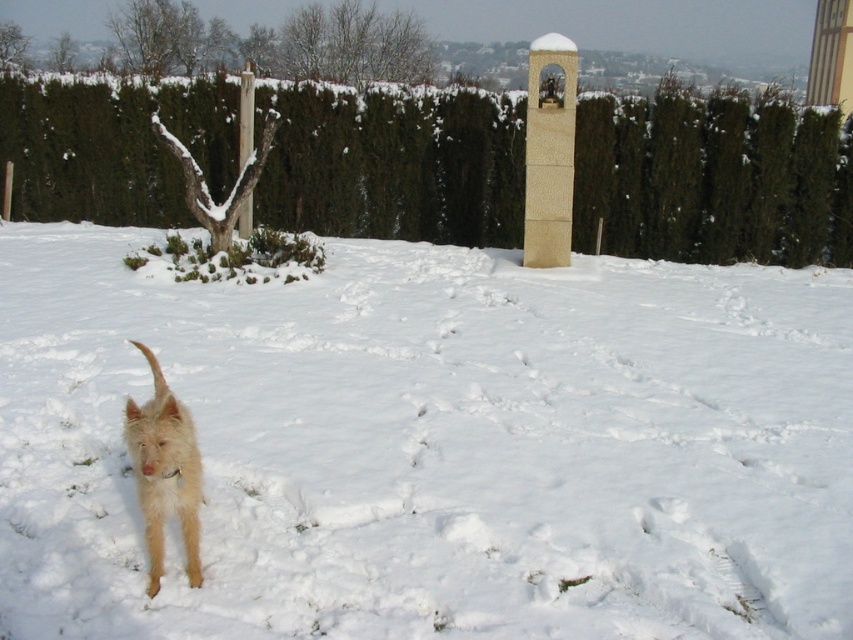
Does green hedge at upper center have a smaller size compared to fuzzy beige dog at lower left?

No, green hedge at upper center is not smaller than fuzzy beige dog at lower left.

Between green hedge at upper center and fuzzy beige dog at lower left, which one has less height?

With less height is fuzzy beige dog at lower left.

Between point (721, 198) and point (155, 468), which one is positioned in front?

Point (155, 468) is more forward.

Locate an element on the screen. This screenshot has height=640, width=853. green hedge at upper center is located at coordinates (712, 179).

Is white fluffy snow at center above green hedge at upper center?

No.

Which is above, white fluffy snow at center or green hedge at upper center?

green hedge at upper center

Find the location of a particular element. Image resolution: width=853 pixels, height=640 pixels. white fluffy snow at center is located at coordinates (431, 444).

Identify the location of white fluffy snow at center. The height and width of the screenshot is (640, 853). (431, 444).

Between white fluffy snow at center and fuzzy beige dog at lower left, which one has more height?

white fluffy snow at center is taller.

What do you see at coordinates (431, 444) in the screenshot? I see `white fluffy snow at center` at bounding box center [431, 444].

At what (x,y) coordinates should I click in order to perform the action: click on white fluffy snow at center. Please return your answer as a coordinate pair (x, y). The image size is (853, 640). Looking at the image, I should click on (431, 444).

At what (x,y) coordinates should I click in order to perform the action: click on white fluffy snow at center. Please return your answer as a coordinate pair (x, y). This screenshot has height=640, width=853. Looking at the image, I should click on (431, 444).